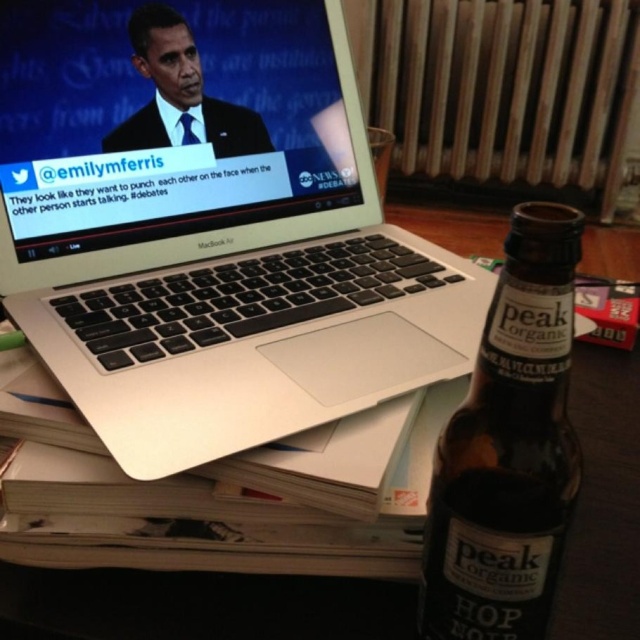
Find the location of `brown glass bottle at lower right`. brown glass bottle at lower right is located at coordinates (508, 449).

Which is more to the right, brown glass bottle at lower right or matte black laptop at upper left?

brown glass bottle at lower right is more to the right.

Who is more distant from viewer, (438, 522) or (54, 266)?

Point (54, 266)

Identify the location of brown glass bottle at lower right. (508, 449).

Can you confirm if brown glass bottle at lower right is bigger than smooth black suit at upper left?

Yes.

Between point (460, 541) and point (189, 51), which one is positioned in front?

Point (460, 541)

Identify the location of brown glass bottle at lower right. This screenshot has width=640, height=640. (508, 449).

Which of these two, matte black laptop at upper left or smooth black suit at upper left, stands shorter?

Standing shorter between the two is smooth black suit at upper left.

Is matte black laptop at upper left positioned at the back of smooth black suit at upper left?

No, it is in front of smooth black suit at upper left.

Is point (356, 104) less distant than point (189, 38)?

No, (356, 104) is further to viewer.

The height and width of the screenshot is (640, 640). Identify the location of matte black laptop at upper left. [x=216, y=228].